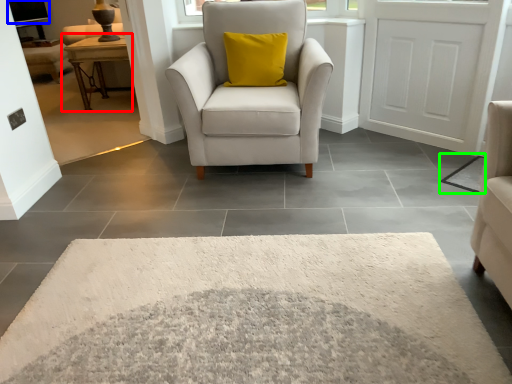
Question: Estimate the real-world distances between objects in this image. Which object is closer to table (highlighted by a red box), window screen (highlighted by a blue box) or mat (highlighted by a green box)?

Choices:
 (A) window screen
 (B) mat

Answer: (A)